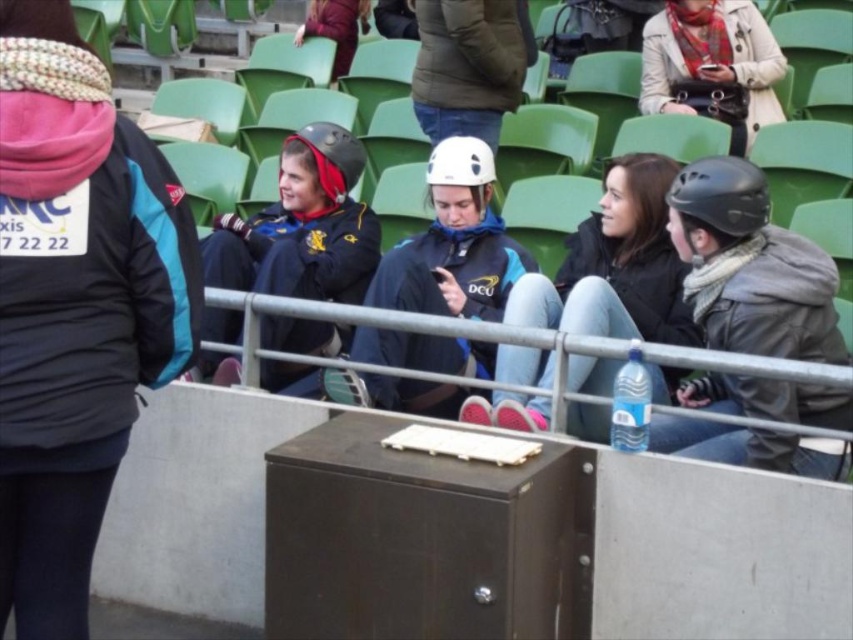
Question: Which object appears farthest from the camera in this image?

Choices:
 (A) matte black helmet at center
 (B) matte black helmet at left

Answer: (B)

Question: Can you confirm if matte black jacket at center is positioned to the left of white matte helmet at center?

Choices:
 (A) no
 (B) yes

Answer: (B)

Question: Which point appears farthest from the camera in this image?

Choices:
 (A) (683, 92)
 (B) (321, 348)
 (C) (405, 360)
 (D) (132, 124)

Answer: (A)

Question: Which object is farther from the camera taking this photo?

Choices:
 (A) matte black jacket at center
 (B) plaid scarf at upper right

Answer: (B)

Question: Does matte black jacket at center appear over matte black helmet at center?

Choices:
 (A) no
 (B) yes

Answer: (A)

Question: From the image, what is the correct spatial relationship of matte black helmet at center in relation to plaid scarf at upper right?

Choices:
 (A) below
 (B) above

Answer: (A)